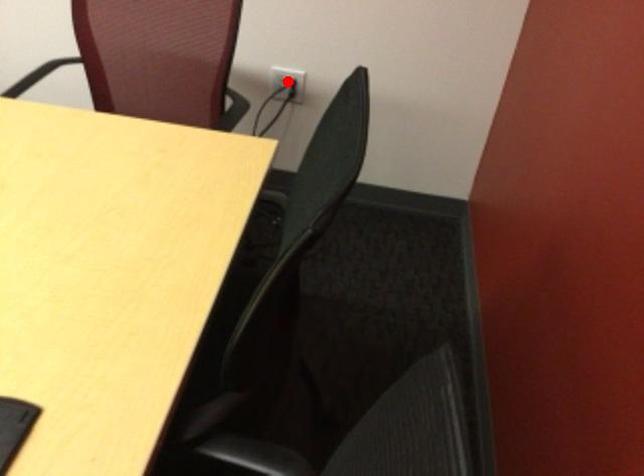
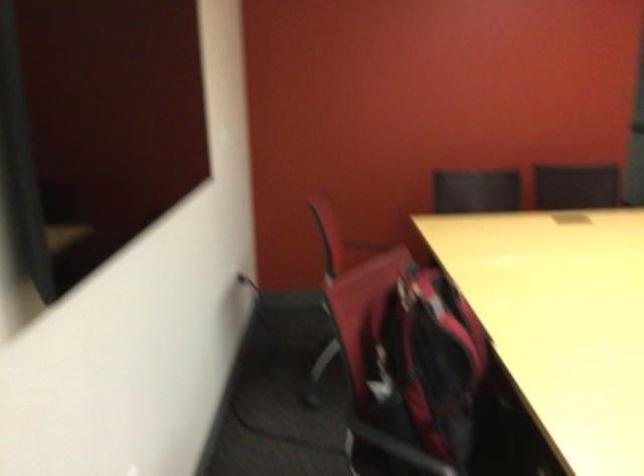
Question: I am providing you with two images of the same scene from different viewpoints. A red point is marked on the first image. Can you still see the location of the red point in image 2?

Choices:
 (A) Yes
 (B) No

Answer: (B)